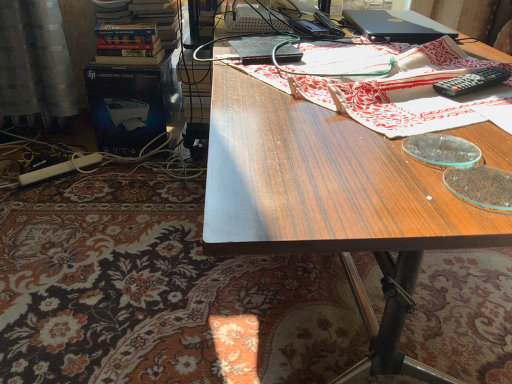
Question: Is wooden desk at center turned away from wooden table at center?

Choices:
 (A) yes
 (B) no

Answer: (B)

Question: From the image's perspective, is wooden desk at center beneath wooden table at center?

Choices:
 (A) no
 (B) yes

Answer: (B)

Question: Is wooden desk at center located outside wooden table at center?

Choices:
 (A) no
 (B) yes

Answer: (B)

Question: From a real-world perspective, is wooden desk at center under wooden table at center?

Choices:
 (A) no
 (B) yes

Answer: (B)

Question: Is wooden desk at center aimed at wooden table at center?

Choices:
 (A) no
 (B) yes

Answer: (A)

Question: Can you confirm if wooden desk at center is shorter than wooden table at center?

Choices:
 (A) no
 (B) yes

Answer: (A)

Question: Does wooden desk at center have a greater width compared to satin curtain at left?

Choices:
 (A) yes
 (B) no

Answer: (A)

Question: From the image's perspective, is wooden desk at center over satin curtain at left?

Choices:
 (A) yes
 (B) no

Answer: (B)

Question: Is wooden desk at center far away from satin curtain at left?

Choices:
 (A) yes
 (B) no

Answer: (A)

Question: Is wooden desk at center shorter than satin curtain at left?

Choices:
 (A) no
 (B) yes

Answer: (A)

Question: Is the depth of wooden desk at center greater than that of satin curtain at left?

Choices:
 (A) yes
 (B) no

Answer: (B)

Question: Is satin curtain at left located within wooden desk at center?

Choices:
 (A) yes
 (B) no

Answer: (B)

Question: Considering the relative sizes of black plastic remote control at upper right and satin curtain at left in the image provided, is black plastic remote control at upper right shorter than satin curtain at left?

Choices:
 (A) yes
 (B) no

Answer: (A)